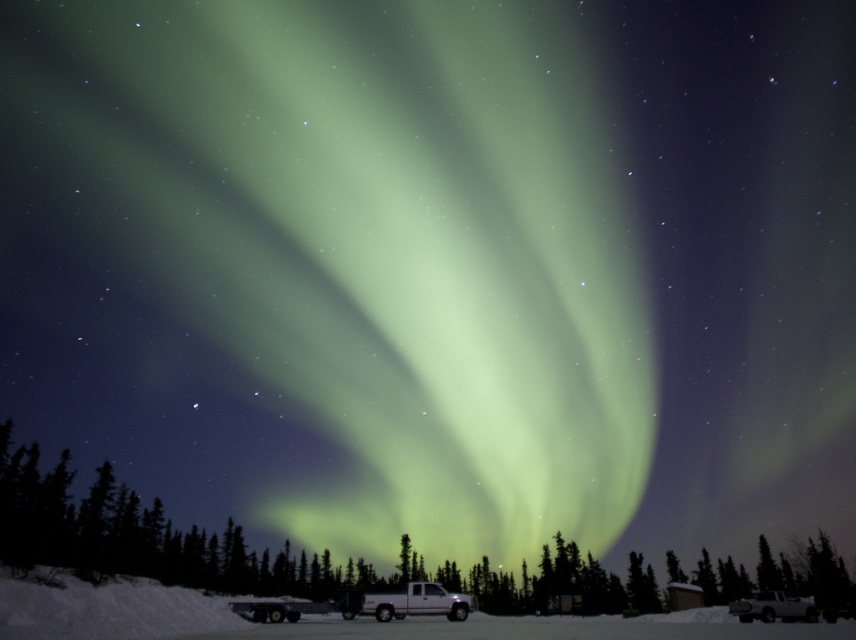
Does green matte tree at center come behind white matte truck at lower right?

No, it is in front of white matte truck at lower right.

This screenshot has height=640, width=856. I want to click on green matte tree at center, so click(x=152, y=538).

What do you see at coordinates (152, 538) in the screenshot?
I see `green matte tree at center` at bounding box center [152, 538].

Locate an element on the screen. green matte tree at center is located at coordinates (152, 538).

Between point (391, 611) and point (750, 600), which one is positioned behind?

Positioned behind is point (750, 600).

Which is above, white matte van at center or white matte truck at lower right?

Positioned higher is white matte van at center.

Find the location of a particular element. This screenshot has height=640, width=856. white matte van at center is located at coordinates (417, 602).

Where is `white matte van at center`? The height and width of the screenshot is (640, 856). white matte van at center is located at coordinates pos(417,602).

Between green matte tree at center and white matte van at center, which one appears on the right side from the viewer's perspective?

Positioned to the right is white matte van at center.

Is point (82, 506) closer to camera compared to point (366, 609)?

No, it is not.

The image size is (856, 640). Find the location of `green matte tree at center`. green matte tree at center is located at coordinates pyautogui.click(x=152, y=538).

Locate an element on the screen. Image resolution: width=856 pixels, height=640 pixels. green matte tree at center is located at coordinates (152, 538).